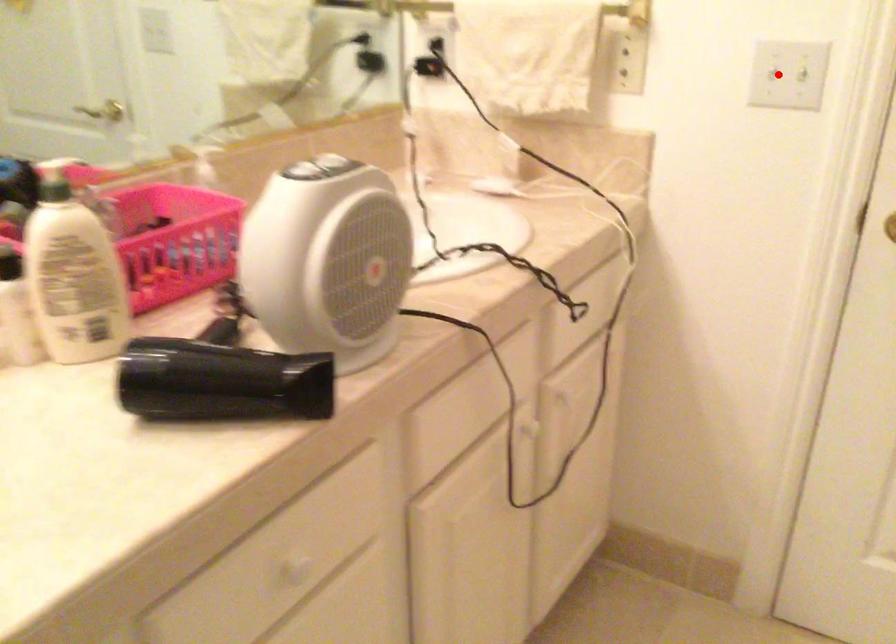
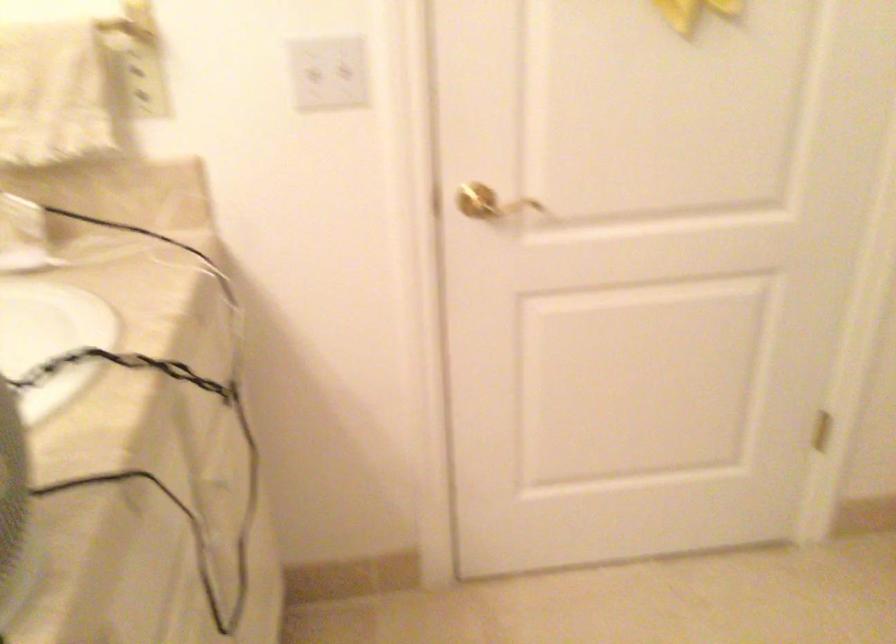
Find the pixel in the second image that matches the highlighted location in the first image.

(323, 69)